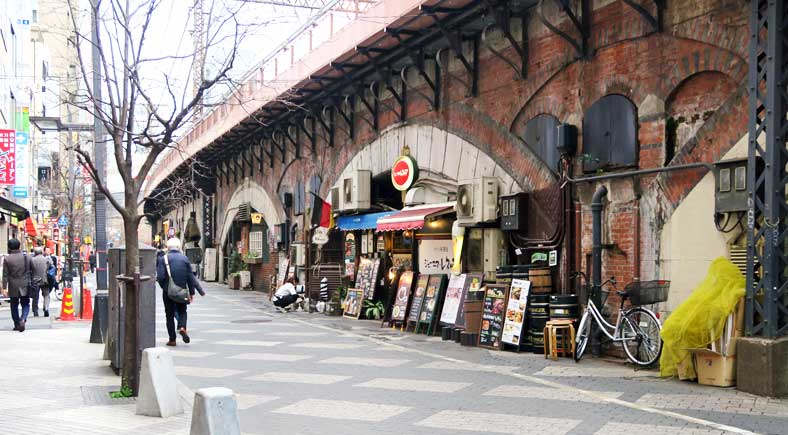
This screenshot has width=788, height=435. I want to click on arched doorways, so click(x=374, y=156), click(x=240, y=193).